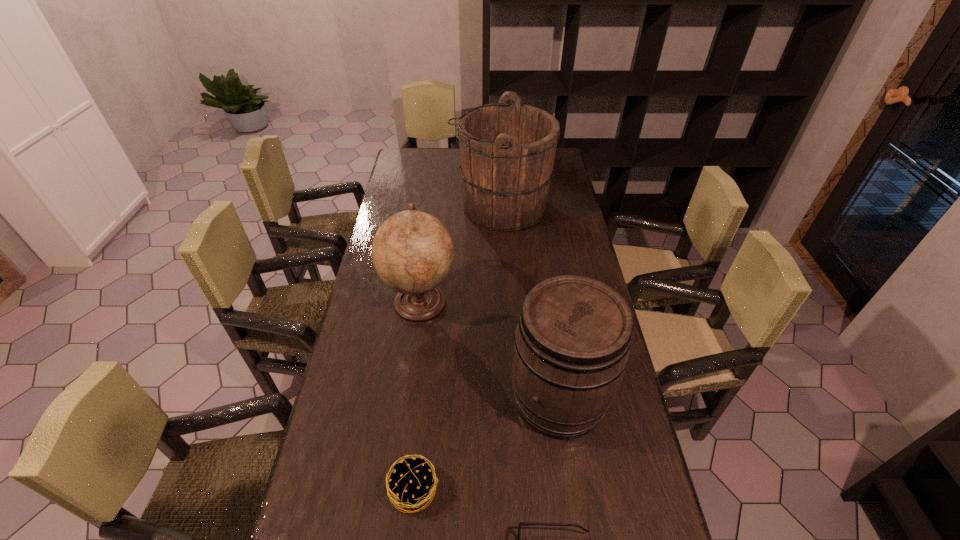
Locate an element on the screen. This screenshot has height=540, width=960. bucket is located at coordinates (507, 151).

This screenshot has height=540, width=960. I want to click on the farthest object, so click(x=507, y=151).

Locate an element on the screen. globe is located at coordinates (412, 252).

The height and width of the screenshot is (540, 960). What are the coordinates of `wine bucket` in the screenshot? It's located at (572, 342).

Identify the location of the fourth tallest object. (412, 483).

Locate an element on the screen. This screenshot has width=960, height=540. patty is located at coordinates (412, 483).

This screenshot has width=960, height=540. In order to click on vacant space situated 0.150m on the front of the farthest object in this screenshot , I will do `click(504, 262)`.

Locate an element on the screen. free space located on the front-facing side of the globe is located at coordinates (548, 301).

Image resolution: width=960 pixels, height=540 pixels. What are the coordinates of `free space located 0.290m on the back of the third farthest object` in the screenshot? It's located at [x=542, y=287].

I want to click on free space located 0.220m on the back of the fourth farthest object, so click(424, 386).